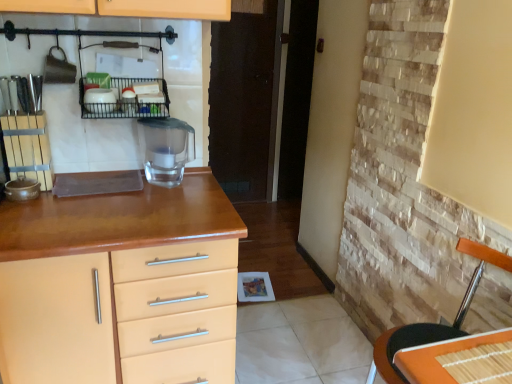
Find the location of `empty space that is ontop of matte wood chest of drawers at left (from a real-world perspective)`. empty space that is ontop of matte wood chest of drawers at left (from a real-world perspective) is located at coordinates (98, 208).